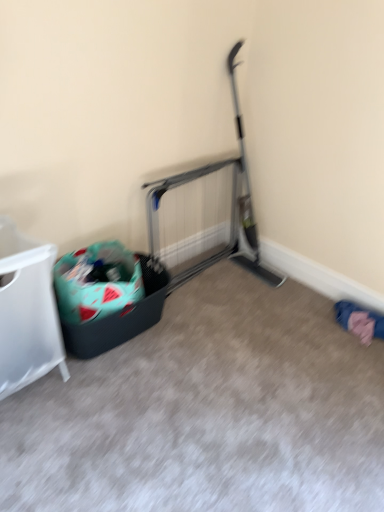
Question: Does point (9, 301) appear closer or farther from the camera than point (130, 251)?

Choices:
 (A) closer
 (B) farther

Answer: (A)

Question: Is white plastic laundry basket at left taller or shorter than teal fabric recycling bin at left?

Choices:
 (A) tall
 (B) short

Answer: (A)

Question: Which is farther from the pink fabric at lower right?

Choices:
 (A) teal fabric recycling bin at left
 (B) white plastic laundry basket at left

Answer: (B)

Question: Considering the real-world distances, which object is closest to the pink fabric at lower right?

Choices:
 (A) white plastic laundry basket at left
 (B) teal fabric recycling bin at left

Answer: (B)